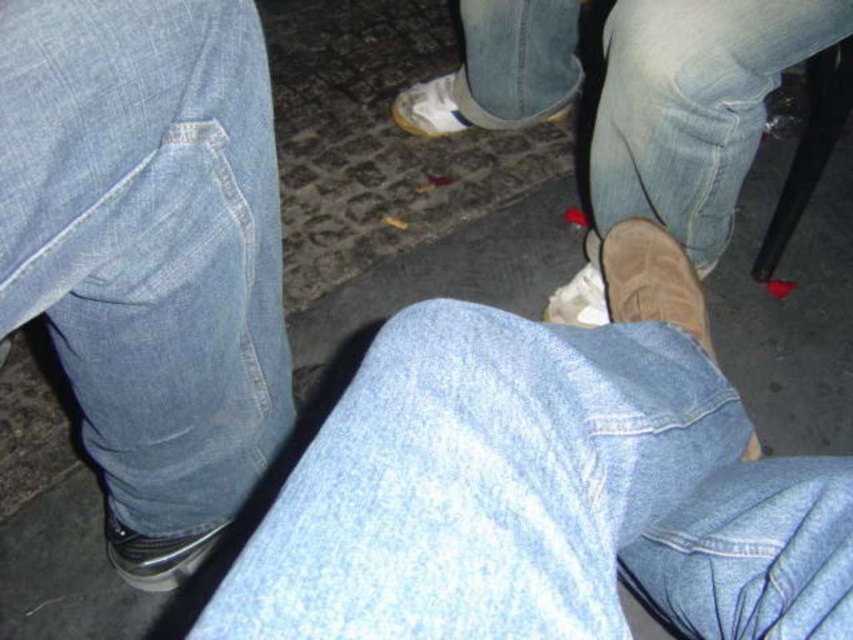
Question: Estimate the real-world distances between objects in this image. Which object is farther from the denim at lower left?

Choices:
 (A) suede brown shoe at center
 (B) white suede shoe at lower center
 (C) light blue denim jeans at center
 (D) suede brown boot at lower right

Answer: (A)

Question: Can you confirm if light blue denim jeans at center is smaller than suede brown shoe at center?

Choices:
 (A) yes
 (B) no

Answer: (B)

Question: Among these objects, which one is nearest to the camera?

Choices:
 (A) light blue denim jeans at center
 (B) denim at lower left
 (C) suede brown boot at lower right

Answer: (A)

Question: Which point appears farthest from the camera in this image?

Choices:
 (A) (688, 314)
 (B) (572, 307)

Answer: (B)

Question: Does metallic silver shoe at lower left have a greater width compared to suede brown shoe at center?

Choices:
 (A) yes
 (B) no

Answer: (B)

Question: Considering the relative positions of denim at lower left and metallic silver shoe at lower left in the image provided, where is denim at lower left located with respect to metallic silver shoe at lower left?

Choices:
 (A) left
 (B) right

Answer: (B)